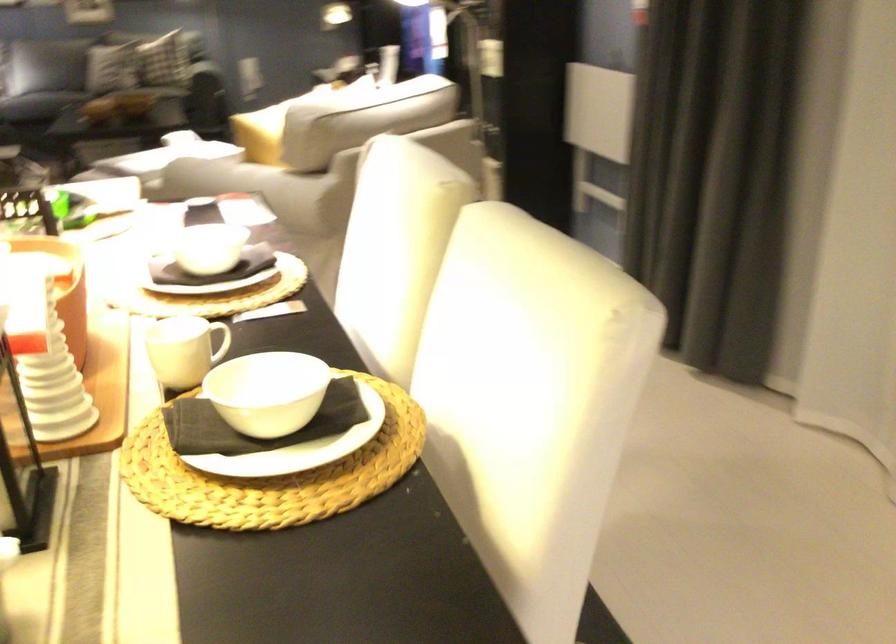
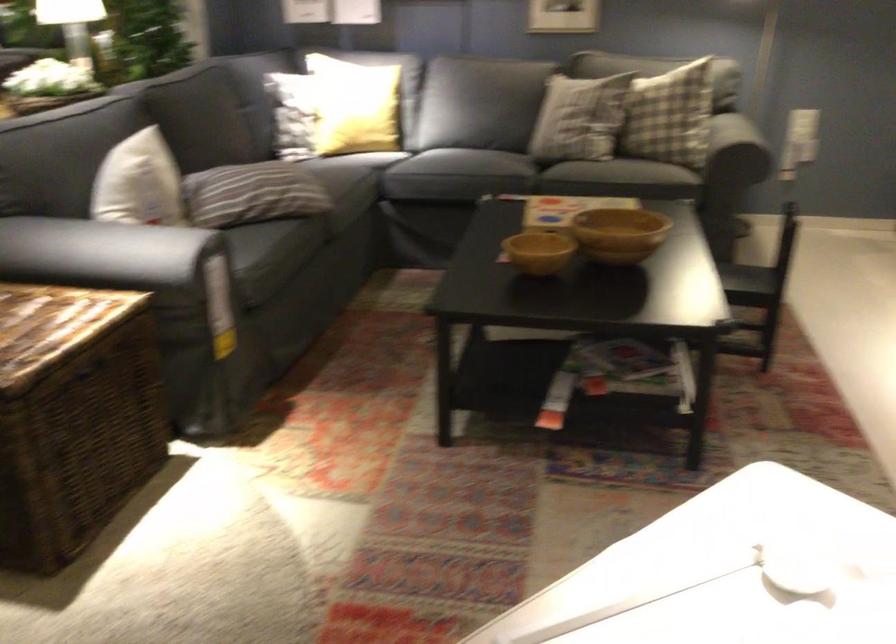
Question: I am providing you with two images of the same scene from different viewpoints. Please identify which objects are invisible in image2.

Choices:
 (A) wicker trunk lid
 (B) large wooden bowl
 (C) plaid pillow
 (D) none of these

Answer: (D)